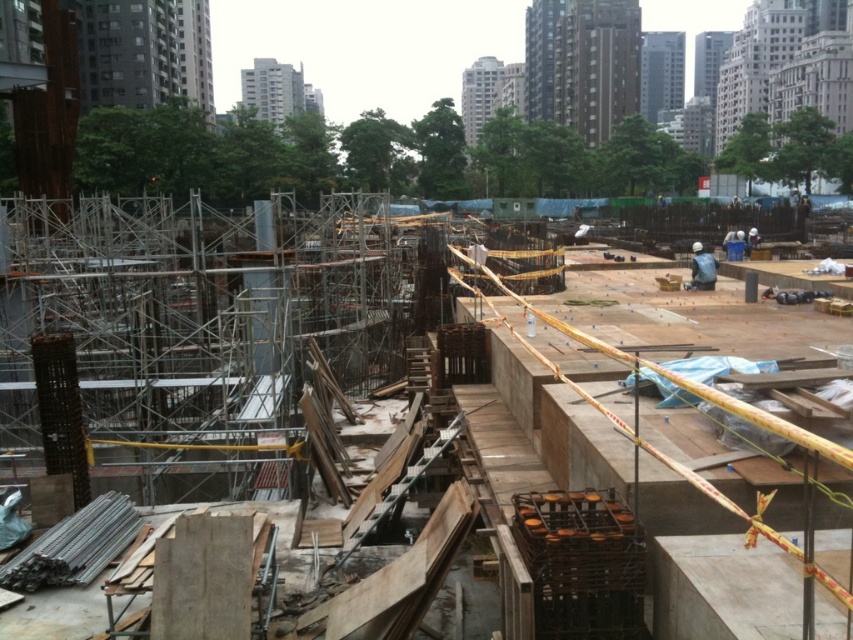
Question: Is silver metallic scaffolding at center wider than blue fabric construction worker at center?

Choices:
 (A) yes
 (B) no

Answer: (A)

Question: Which object is closer to the camera taking this photo?

Choices:
 (A) blue fabric construction worker at center
 (B) silver metallic scaffolding at center
 (C) concrete at center
 (D) concrete scaffolding at center

Answer: (C)

Question: Can you confirm if concrete at center is positioned above blue fabric construction worker at center?

Choices:
 (A) yes
 (B) no

Answer: (B)

Question: Which of the following is the farthest from the observer?

Choices:
 (A) (9, 419)
 (B) (27, 221)
 (C) (699, 285)

Answer: (B)

Question: Can you confirm if silver metallic scaffolding at center is positioned to the right of blue fabric construction worker at center?

Choices:
 (A) no
 (B) yes

Answer: (A)

Question: Considering the real-world distances, which object is farthest from the silver metallic scaffolding at center?

Choices:
 (A) concrete at center
 (B) concrete scaffolding at center
 (C) blue fabric construction worker at center

Answer: (C)